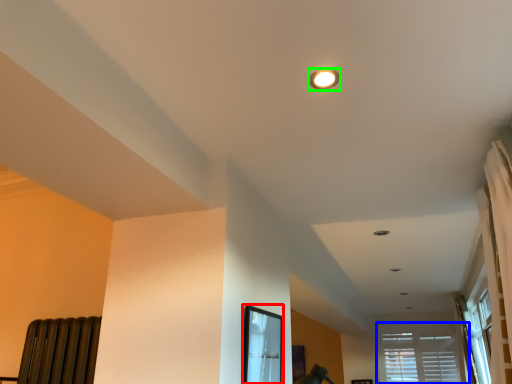
Question: Based on their relative distances, which object is farther from bay window (highlighted by a red box)? Choose from window (highlighted by a blue box) and lighting (highlighted by a green box).

Choices:
 (A) window
 (B) lighting

Answer: (A)